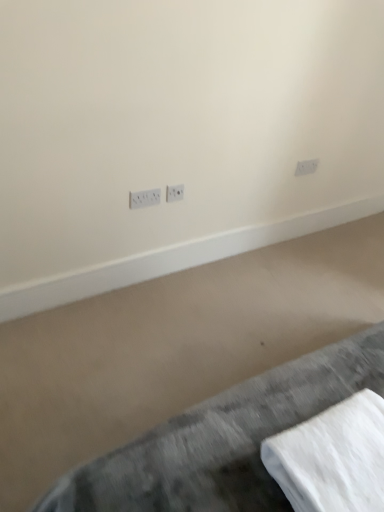
Question: From a real-world perspective, is gray fabric bed at lower right located beneath white plastic power plugs and sockets at upper right, the third power plugs and sockets positioned from the bottom?

Choices:
 (A) no
 (B) yes

Answer: (B)

Question: Is gray fabric bed at lower right to the right of white plastic power plugs and sockets at upper right, the 3th power plugs and sockets from the left, from the viewer's perspective?

Choices:
 (A) no
 (B) yes

Answer: (A)

Question: Does gray fabric bed at lower right touch white plastic power plugs and sockets at upper right, the third power plugs and sockets positioned from the bottom?

Choices:
 (A) no
 (B) yes

Answer: (A)

Question: Is gray fabric bed at lower right smaller than white plastic power plugs and sockets at upper right, the third power plugs and sockets positioned from the bottom?

Choices:
 (A) no
 (B) yes

Answer: (A)

Question: Considering the relative positions of gray fabric bed at lower right and white plastic power plugs and sockets at upper right, acting as the first power plugs and sockets starting from the back, in the image provided, is gray fabric bed at lower right to the left of white plastic power plugs and sockets at upper right, acting as the first power plugs and sockets starting from the back, from the viewer's perspective?

Choices:
 (A) yes
 (B) no

Answer: (A)

Question: Considering the positions of point (74, 501) and point (178, 189), is point (74, 501) closer or farther from the camera than point (178, 189)?

Choices:
 (A) farther
 (B) closer

Answer: (B)

Question: In terms of size, does gray fabric bed at lower right appear bigger or smaller than white plastic power plugs and sockets at center, which is counted as the 2th power plugs and sockets, starting from the top?

Choices:
 (A) small
 (B) big

Answer: (B)

Question: Is gray fabric bed at lower right wider or thinner than white plastic power plugs and sockets at center, which is counted as the 2th power plugs and sockets, starting from the right?

Choices:
 (A) wide
 (B) thin

Answer: (A)

Question: In terms of height, does gray fabric bed at lower right look taller or shorter compared to white plastic power plugs and sockets at center, the 2th power plugs and sockets when ordered from front to back?

Choices:
 (A) tall
 (B) short

Answer: (A)

Question: Based on their sizes in the image, would you say white plastic power plugs and sockets at center, placed as the 1th power plugs and sockets when sorted from left to right, is bigger or smaller than gray fabric bed at lower right?

Choices:
 (A) big
 (B) small

Answer: (B)

Question: From a real-world perspective, relative to gray fabric bed at lower right, is white plastic power plugs and sockets at center, which is the 3th power plugs and sockets in right-to-left order, vertically above or below?

Choices:
 (A) below
 (B) above

Answer: (B)

Question: Is point (158, 201) closer or farther from the camera than point (125, 499)?

Choices:
 (A) farther
 (B) closer

Answer: (A)

Question: From the image's perspective, is white plastic power plugs and sockets at center, which is the 3th power plugs and sockets in right-to-left order, above or below gray fabric bed at lower right?

Choices:
 (A) above
 (B) below

Answer: (A)

Question: In terms of width, does white plastic power plugs and sockets at center, marked as the 1th power plugs and sockets in a front-to-back arrangement, look wider or thinner when compared to white plastic power plugs and sockets at upper right, which is counted as the first power plugs and sockets, starting from the right?

Choices:
 (A) thin
 (B) wide

Answer: (B)

Question: Considering their positions, is white plastic power plugs and sockets at center, acting as the 3th power plugs and sockets starting from the top, located in front of or behind white plastic power plugs and sockets at upper right, the 3th power plugs and sockets from the left?

Choices:
 (A) behind
 (B) front

Answer: (B)